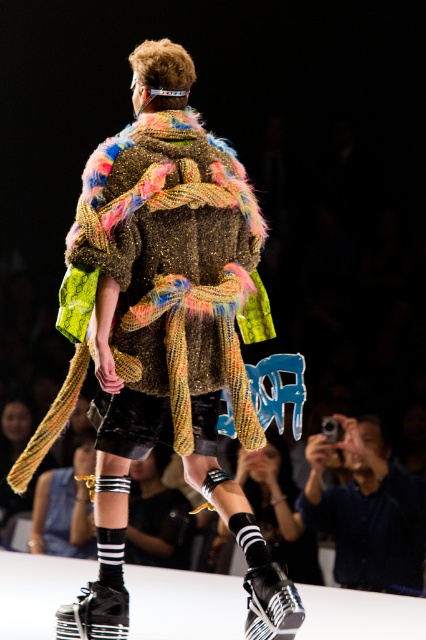
Question: Can you confirm if fuzzy multicolored coat at center is positioned above blue denim shirt at lower right?

Choices:
 (A) yes
 (B) no

Answer: (A)

Question: Does fuzzy multicolored coat at center have a larger size compared to blue denim shirt at lower right?

Choices:
 (A) yes
 (B) no

Answer: (B)

Question: Which of the following is the farthest from the observer?

Choices:
 (A) (339, 573)
 (B) (123, 314)

Answer: (A)

Question: Which object appears farthest from the camera in this image?

Choices:
 (A) fuzzy multicolored coat at center
 (B) blue denim shirt at lower right

Answer: (B)

Question: Which of the following is the closest to the observer?

Choices:
 (A) blue denim shirt at lower right
 (B) fuzzy multicolored coat at center

Answer: (B)

Question: Can you confirm if fuzzy multicolored coat at center is positioned to the left of blue denim shirt at lower right?

Choices:
 (A) no
 (B) yes

Answer: (B)